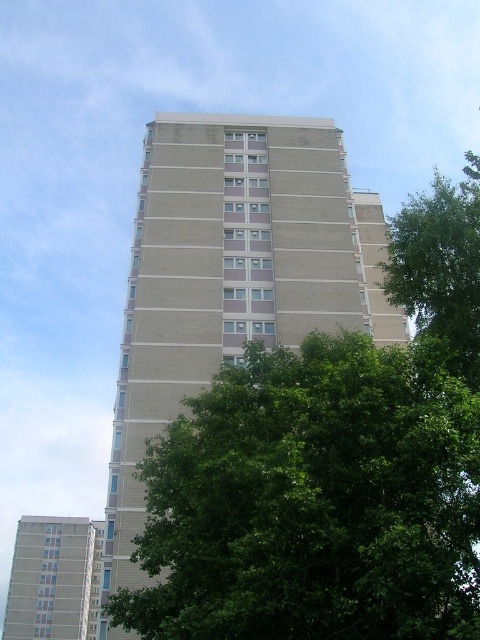
You are standing in a park and see the green leafy tree at right and the beige concrete building at lower left. Which object appears larger in the image?

The green leafy tree at right appears larger than the beige concrete building at lower left in the image.

You are standing in front of the residential highrise and notice two points marked on the building. The first point is at coordinate point (x=463, y=186) and the second is at point (x=93, y=573). Which point is closer to your viewpoint?

Point (x=463, y=186) is closer to the camera than point (x=93, y=573).

You are a bird flying over the city and want to land on the tallest object between the beige brick building at center and the green leafy tree at right. Which one should you choose?

The green leafy tree at right is taller than the beige brick building at center, so you should land on the green leafy tree at right.